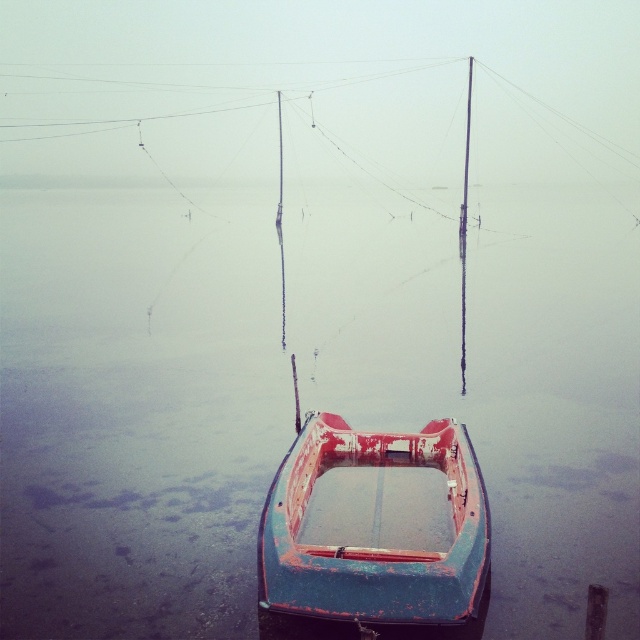
Question: Among these objects, which one is nearest to the camera?

Choices:
 (A) rusty metal water at center
 (B) rusty metal boat at center

Answer: (A)

Question: Is rusty metal water at center positioned in front of rusty metal boat at center?

Choices:
 (A) no
 (B) yes

Answer: (B)

Question: Is rusty metal water at center closer to camera compared to rusty metal boat at center?

Choices:
 (A) yes
 (B) no

Answer: (A)

Question: Can you confirm if rusty metal water at center is positioned below rusty metal boat at center?

Choices:
 (A) yes
 (B) no

Answer: (B)

Question: Which of the following is the closest to the observer?

Choices:
 (A) rusty metal water at center
 (B) rusty metal boat at center

Answer: (A)